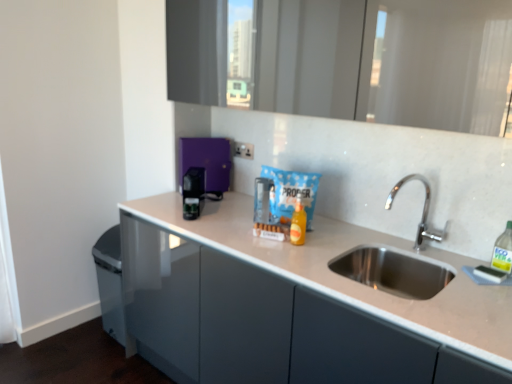
I want to click on free region on the left part of green translucent bottle at right, which is the 2th bottle in left-to-right order, so click(x=462, y=271).